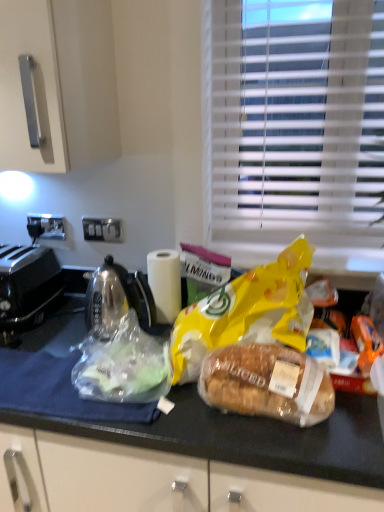
The width and height of the screenshot is (384, 512). What do you see at coordinates (244, 311) in the screenshot?
I see `yellow matte plastic bag at center, marked as the second plastic bag in a left-to-right arrangement` at bounding box center [244, 311].

In order to click on black plastic toaster at left in this screenshot , I will do `click(26, 287)`.

What is the approximate width of yellow plastic bag at upper center?

yellow plastic bag at upper center is 13.86 centimeters in width.

This screenshot has width=384, height=512. What do you see at coordinates (122, 364) in the screenshot?
I see `translucent plastic bag at center, positioned as the second plastic bag in right-to-left order` at bounding box center [122, 364].

Measure the distance between white matte paper towel at center and camera.

They are 4.07 feet apart.

In order to click on white plastic blinds at upper right in this screenshot , I will do `click(296, 121)`.

This screenshot has height=512, width=384. In order to click on translucent plastic bread at center in this screenshot , I will do `click(267, 383)`.

Considering the relative sizes of translucent plastic bag at center and white plastic blinds at upper right in the image provided, is translucent plastic bag at center wider than white plastic blinds at upper right?

Correct, the width of translucent plastic bag at center exceeds that of white plastic blinds at upper right.

Are translucent plastic bag at center and white plastic blinds at upper right far apart?

They are positioned close to each other.

From the picture: From the image's perspective, who appears lower, translucent plastic bag at center or white plastic blinds at upper right?

translucent plastic bag at center is shown below in the image.

Which object is positioned more to the right, translucent plastic bag at center or white plastic blinds at upper right?

white plastic blinds at upper right is more to the right.

Considering the sizes of objects yellow plastic bag at upper center and translucent plastic bread at center in the image provided, who is shorter, yellow plastic bag at upper center or translucent plastic bread at center?

Standing shorter between the two is yellow plastic bag at upper center.

Would you say yellow plastic bag at upper center is inside or outside translucent plastic bread at center?

yellow plastic bag at upper center is outside translucent plastic bread at center.

The height and width of the screenshot is (512, 384). What are the coordinates of `bread located on the left of yellow plastic bag at upper center` in the screenshot? It's located at (267, 383).

Does point (325, 252) appear closer or farther from the camera than point (313, 362)?

Point (325, 252) is farther from the camera than point (313, 362).

Consider the image. Is translucent plastic bread at center positioned in front of white matte paper towel at center?

Yes, the depth of translucent plastic bread at center is less than that of white matte paper towel at center.

Where is `paper towel above the translucent plastic bread at center (from a real-world perspective)`? paper towel above the translucent plastic bread at center (from a real-world perspective) is located at coordinates 165,283.

Considering the relative sizes of translucent plastic bread at center and white matte paper towel at center in the image provided, is translucent plastic bread at center bigger than white matte paper towel at center?

Yes.

Which is less distant, (257, 315) or (105, 390)?

Point (257, 315) is positioned farther from the camera compared to point (105, 390).

Does yellow matte plastic bag at center, the first plastic bag viewed from the right, have a larger size compared to translucent plastic bag at center, positioned as the second plastic bag in right-to-left order?

Yes.

Is yellow matte plastic bag at center, marked as the second plastic bag in a left-to-right arrangement, to the left or to the right of translucent plastic bag at center, which is the 1th plastic bag in left-to-right order, in the image?

From the image, it's evident that yellow matte plastic bag at center, marked as the second plastic bag in a left-to-right arrangement, is to the right of translucent plastic bag at center, which is the 1th plastic bag in left-to-right order.

From a real-world perspective, is yellow matte plastic bag at center, the first plastic bag viewed from the right, positioned above or below translucent plastic bag at center, positioned as the second plastic bag in right-to-left order?

yellow matte plastic bag at center, the first plastic bag viewed from the right, is above translucent plastic bag at center, positioned as the second plastic bag in right-to-left order.

Can you confirm if black plastic toaster at left is smaller than white matte paper towel at center?

No, black plastic toaster at left is not smaller than white matte paper towel at center.

Considering the sizes of black plastic toaster at left and white matte paper towel at center in the image, is black plastic toaster at left wider or thinner than white matte paper towel at center?

Clearly, black plastic toaster at left has more width compared to white matte paper towel at center.

Identify the location of paper towel that is above the black plastic toaster at left (from a real-world perspective). The height and width of the screenshot is (512, 384). (165, 283).

In the scene shown: What's the angular difference between black plastic toaster at left and white matte paper towel at center's facing directions?

The facing directions of black plastic toaster at left and white matte paper towel at center are 5.09 degrees apart.

Is black plastic toaster at left behind yellow matte plastic bag at center, marked as the second plastic bag in a left-to-right arrangement?

Yes.

Image resolution: width=384 pixels, height=512 pixels. Identify the location of toaster behind the yellow matte plastic bag at center, the first plastic bag viewed from the right. (26, 287).

Between black plastic toaster at left and yellow matte plastic bag at center, marked as the second plastic bag in a left-to-right arrangement, which one has larger size?

With larger size is yellow matte plastic bag at center, marked as the second plastic bag in a left-to-right arrangement.

Which of these two, black plastic toaster at left or yellow matte plastic bag at center, marked as the second plastic bag in a left-to-right arrangement, is thinner?

Thinner between the two is yellow matte plastic bag at center, marked as the second plastic bag in a left-to-right arrangement.

Between point (142, 373) and point (217, 94), which one is positioned in front?

The point (142, 373) is closer.

Based on the photo, considering the positions of objects translucent plastic bag at center, which is the 1th plastic bag in left-to-right order, and white plastic blinds at upper right in the image provided, who is behind, translucent plastic bag at center, which is the 1th plastic bag in left-to-right order, or white plastic blinds at upper right?

white plastic blinds at upper right is further away from the camera.

From a real-world perspective, is translucent plastic bag at center, positioned as the second plastic bag in right-to-left order, on top of white plastic blinds at upper right?

No, from a real-world perspective, translucent plastic bag at center, positioned as the second plastic bag in right-to-left order, is not on top of white plastic blinds at upper right.

Locate an element on the screen. The image size is (384, 512). window blind above the translucent plastic bag at center (from a real-world perspective) is located at coordinates (296, 121).

You are a GUI agent. You are given a task and a screenshot of the screen. Output one action in this format:
    pyautogui.click(x=<x>, y=<y>)
    Task: Click on the bread that is in front of the yellow plastic bag at upper center
    This screenshot has width=384, height=512.
    Given the screenshot: What is the action you would take?
    pyautogui.click(x=267, y=383)

From the image, which object appears to be nearer to white matte paper towel at center, translucent plastic bag at center or black plastic toaster at left?

translucent plastic bag at center is positioned closer to the anchor white matte paper towel at center.

From the image, which object appears to be nearer to translucent plastic bag at center, which is the 1th plastic bag in left-to-right order, translucent plastic bread at center or translucent plastic bag at center?

translucent plastic bag at center is positioned closer to the anchor translucent plastic bag at center, which is the 1th plastic bag in left-to-right order.

Which object lies further to the anchor point yellow plastic bag at upper center, translucent plastic bread at center or white plastic blinds at upper right?

translucent plastic bread at center is further to yellow plastic bag at upper center.

Which object lies further to the anchor point translucent plastic bag at center, positioned as the second plastic bag in right-to-left order, yellow plastic bag at upper center or white matte paper towel at center?

Among the two, yellow plastic bag at upper center is located further to translucent plastic bag at center, positioned as the second plastic bag in right-to-left order.

When comparing their distances from yellow plastic bag at upper center, does translucent plastic bread at center or translucent plastic bag at center, which is the 1th plastic bag in left-to-right order, seem closer?

translucent plastic bread at center lies closer to yellow plastic bag at upper center than the other object.

When comparing their distances from white plastic blinds at upper right, does yellow matte plastic bag at center, marked as the second plastic bag in a left-to-right arrangement, or yellow plastic bag at upper center seem closer?

The object closer to white plastic blinds at upper right is yellow plastic bag at upper center.

Estimate the real-world distances between objects in this image. Which object is further from translucent plastic bag at center, translucent plastic bread at center or black plastic toaster at left?

Based on the image, translucent plastic bread at center appears to be further to translucent plastic bag at center.

From the image, which object appears to be nearer to translucent plastic bag at center, black plastic toaster at left or white plastic blinds at upper right?

The object closer to translucent plastic bag at center is black plastic toaster at left.

Find the location of a particular element. This screenshot has width=384, height=512. paper towel between black plastic toaster at left and yellow plastic bag at upper center from left to right is located at coordinates (165, 283).

Where is `plastic bag that lies between white plastic blinds at upper right and translucent plastic bag at center, positioned as the second plastic bag in right-to-left order, from top to bottom`? plastic bag that lies between white plastic blinds at upper right and translucent plastic bag at center, positioned as the second plastic bag in right-to-left order, from top to bottom is located at coordinates (244, 311).

Where is `cloth between black plastic toaster at left and yellow matte plastic bag at center, marked as the second plastic bag in a left-to-right arrangement`? Image resolution: width=384 pixels, height=512 pixels. cloth between black plastic toaster at left and yellow matte plastic bag at center, marked as the second plastic bag in a left-to-right arrangement is located at coordinates (58, 390).

Locate an element on the screen. The image size is (384, 512). paper towel between white plastic blinds at upper right and translucent plastic bag at center vertically is located at coordinates (165, 283).